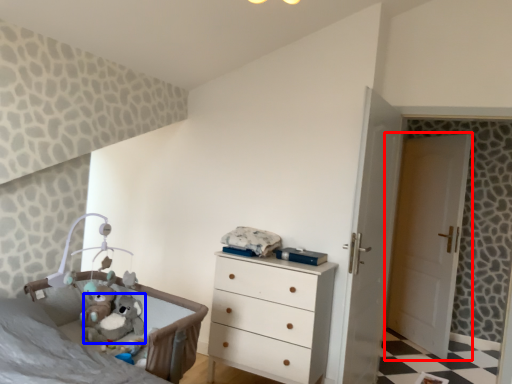
Question: Which of the following is the closest to the observer, door (highlighted by a red box) or animal (highlighted by a blue box)?

Choices:
 (A) door
 (B) animal

Answer: (B)